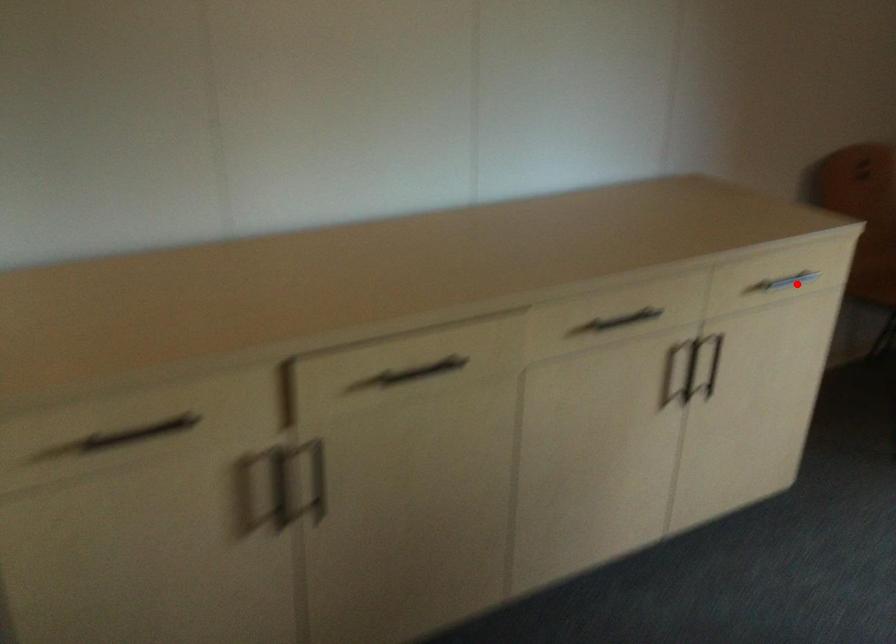
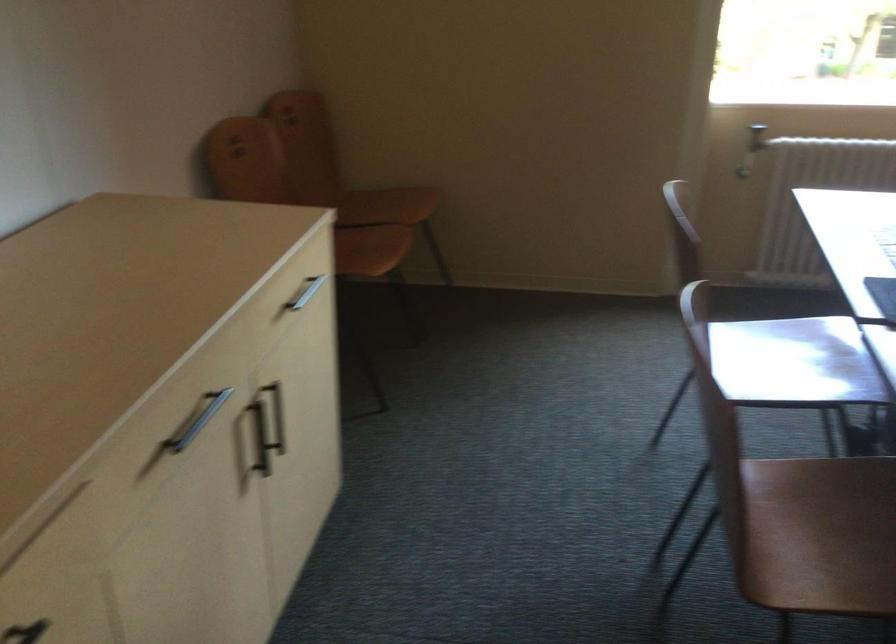
In the second image, find the point that corresponds to the highlighted location in the first image.

(305, 292)